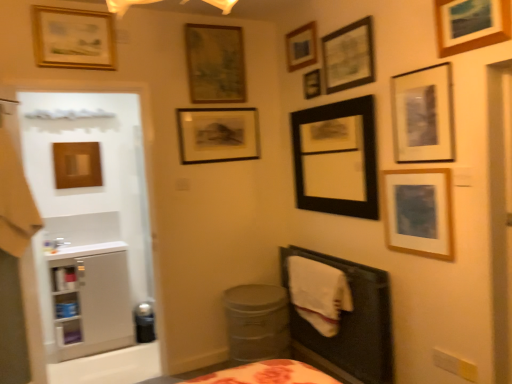
How much space does black matte picture frame at center, which appears as the fourth picture frame when viewed from the left, occupy horizontally?

black matte picture frame at center, which appears as the fourth picture frame when viewed from the left, is 1.61 inches in width.

What do you see at coordinates (144, 322) in the screenshot? I see `black plastic potty at lower left, the 2th potty when ordered from front to back` at bounding box center [144, 322].

Describe the element at coordinates (91, 232) in the screenshot. This screenshot has width=512, height=384. I see `white glossy cabinet at left` at that location.

What do you see at coordinates (91, 300) in the screenshot?
I see `white matte medicine cabinet at left` at bounding box center [91, 300].

Image resolution: width=512 pixels, height=384 pixels. In order to click on black matte picture frame at center, which ranks as the eighth picture frame in right-to-left order in this screenshot , I will do `click(217, 134)`.

Can you tell me how much gold-framed picture at upper left, which ranks as the tenth picture frame in right-to-left order, and white glossy cabinet at left differ in facing direction?

The angle between the facing direction of gold-framed picture at upper left, which ranks as the tenth picture frame in right-to-left order, and the facing direction of white glossy cabinet at left is 1.93 degrees.

Does gold-framed picture at upper left, the 2th picture frame from the left, have a greater width compared to white glossy cabinet at left?

No, gold-framed picture at upper left, the 2th picture frame from the left, is not wider than white glossy cabinet at left.

Between gold-framed picture at upper left, the 2th picture frame from the left, and white glossy cabinet at left, which one appears on the right side from the viewer's perspective?

white glossy cabinet at left.

Is white glossy cabinet at left surrounded by gold-framed picture at upper left, the 2th picture frame from the left?

No, white glossy cabinet at left is not surrounded by gold-framed picture at upper left, the 2th picture frame from the left.

Between gold-framed picture at upper left, which ranks as the tenth picture frame in right-to-left order, and wooden framed print at right, marked as the tenth picture frame in a left-to-right arrangement, which one has smaller size?

wooden framed print at right, marked as the tenth picture frame in a left-to-right arrangement.

Is point (38, 21) positioned behind point (414, 215)?

Yes, it is behind point (414, 215).

Is gold-framed picture at upper left, which ranks as the tenth picture frame in right-to-left order, positioned with its back to wooden framed print at right, marked as the tenth picture frame in a left-to-right arrangement?

That's not correct — gold-framed picture at upper left, which ranks as the tenth picture frame in right-to-left order, is not looking away from wooden framed print at right, marked as the tenth picture frame in a left-to-right arrangement.

Looking at this image, considering the sizes of objects wooden framed print at right, positioned as the second picture frame in right-to-left order, and metallic gray potty at lower center, the 1th potty when ordered from right to left, in the image provided, who is thinner, wooden framed print at right, positioned as the second picture frame in right-to-left order, or metallic gray potty at lower center, the 1th potty when ordered from right to left,?

wooden framed print at right, positioned as the second picture frame in right-to-left order, is thinner.

Is wooden framed print at right, marked as the tenth picture frame in a left-to-right arrangement, situated inside metallic gray potty at lower center, the 1th potty when ordered from right to left, or outside?

wooden framed print at right, marked as the tenth picture frame in a left-to-right arrangement, is not inside metallic gray potty at lower center, the 1th potty when ordered from right to left, it's outside.

Is point (389, 213) farther from camera compared to point (239, 348)?

No, it is in front of (239, 348).

Locate an element on the screen. The image size is (512, 384). the 1st potty below the wooden framed print at right, positioned as the second picture frame in right-to-left order (from the image's perspective) is located at coordinates (257, 322).

Is metallic gray potty at lower center, the 2th potty when ordered from left to right, inside or outside of white matte medicine cabinet at left?

metallic gray potty at lower center, the 2th potty when ordered from left to right, is outside white matte medicine cabinet at left.

From the image's perspective, relative to white matte medicine cabinet at left, is metallic gray potty at lower center, placed as the 2th potty when sorted from back to front, above or below?

Clearly, from the image's perspective, metallic gray potty at lower center, placed as the 2th potty when sorted from back to front, is below white matte medicine cabinet at left.

What's the angular difference between metallic gray potty at lower center, the 2th potty when ordered from left to right, and white matte medicine cabinet at left's facing directions?

0.145 degrees.

Is metallic gray potty at lower center, the 1th potty when ordered from right to left, closer to camera compared to white matte medicine cabinet at left?

Yes, the depth of metallic gray potty at lower center, the 1th potty when ordered from right to left, is less than that of white matte medicine cabinet at left.

Considering the relative positions of black plastic potty at lower left, acting as the first potty starting from the left, and wooden textured picture frame at upper center, the 3th picture frame viewed from the left, in the image provided, is black plastic potty at lower left, acting as the first potty starting from the left, to the left of wooden textured picture frame at upper center, the 3th picture frame viewed from the left, from the viewer's perspective?

Yes, black plastic potty at lower left, acting as the first potty starting from the left, is to the left of wooden textured picture frame at upper center, the 3th picture frame viewed from the left.

In the image, is black plastic potty at lower left, the 2th potty when ordered from front to back, positioned in front of or behind wooden textured picture frame at upper center, the 3th picture frame viewed from the left?

black plastic potty at lower left, the 2th potty when ordered from front to back, is positioned farther from the viewer than wooden textured picture frame at upper center, the 3th picture frame viewed from the left.

From a real-world perspective, is black plastic potty at lower left, the first potty positioned from the back, under wooden textured picture frame at upper center, which appears as the 9th picture frame when viewed from the right?

Yes, from a real-world perspective, black plastic potty at lower left, the first potty positioned from the back, is under wooden textured picture frame at upper center, which appears as the 9th picture frame when viewed from the right.

The image size is (512, 384). I want to click on the 4th picture frame in front of the brown matte picture frame at upper left, which ranks as the 1th picture frame in left-to-right order, so click(x=301, y=47).

Could you tell me if brown matte picture frame at upper left, which ranks as the 1th picture frame in left-to-right order, is turned towards wooden picture frame at upper center, marked as the seventh picture frame in a right-to-left arrangement?

No, brown matte picture frame at upper left, which ranks as the 1th picture frame in left-to-right order, is not turned towards wooden picture frame at upper center, marked as the seventh picture frame in a right-to-left arrangement.

Which is behind, point (87, 146) or point (287, 49)?

The point (87, 146) is farther from the camera.

Can you confirm if brown matte picture frame at upper left, which is the eleventh picture frame in right-to-left order, is wider than wooden picture frame at upper center, marked as the seventh picture frame in a right-to-left arrangement?

Incorrect, the width of brown matte picture frame at upper left, which is the eleventh picture frame in right-to-left order, does not surpass that of wooden picture frame at upper center, marked as the seventh picture frame in a right-to-left arrangement.

What's the angular difference between metallic gray potty at lower center, the 1th potty from the front, and black matte picture frame at upper center, which is the 5th picture frame from right to left,'s facing directions?

89.8 degrees separate the facing orientations of metallic gray potty at lower center, the 1th potty from the front, and black matte picture frame at upper center, which is the 5th picture frame from right to left.

From a real-world perspective, is metallic gray potty at lower center, the 1th potty from the front, positioned above or below black matte picture frame at upper center, which is the 7th picture frame from left to right?

Clearly, from a real-world perspective, metallic gray potty at lower center, the 1th potty from the front, is below black matte picture frame at upper center, which is the 7th picture frame from left to right.

Is metallic gray potty at lower center, the 1th potty when ordered from right to left, located outside black matte picture frame at upper center, which is the 7th picture frame from left to right?

That's correct, metallic gray potty at lower center, the 1th potty when ordered from right to left, is outside of black matte picture frame at upper center, which is the 7th picture frame from left to right.

From the image's perspective, is metallic gray potty at lower center, the 1th potty when ordered from right to left, above black matte picture frame at upper center, which is the 5th picture frame from right to left?

No, from the image's perspective, metallic gray potty at lower center, the 1th potty when ordered from right to left, is not on top of black matte picture frame at upper center, which is the 5th picture frame from right to left.

Identify the location of screen door that is on the right side of gold-framed picture at upper left, the 2th picture frame from the left. This screenshot has width=512, height=384. (91, 232).

Locate an element on the screen. the 8th picture frame to the left of the wooden framed print at right, marked as the tenth picture frame in a left-to-right arrangement, starting your count from the anchor is located at coordinates (73, 38).

Considering their positions, is wooden textured picture frame at upper center, the 3th picture frame viewed from the left, positioned further to white matte medicine cabinet at left than black plastic potty at lower left, the first potty positioned from the back?

wooden textured picture frame at upper center, the 3th picture frame viewed from the left.

Looking at the image, which one is located closer to matte black picture frame at upper center, which ranks as the eighth picture frame in left-to-right order, brown matte picture frame at upper left, which is the eleventh picture frame in right-to-left order, or metallic gray potty at lower center, the 2th potty when ordered from left to right?

metallic gray potty at lower center, the 2th potty when ordered from left to right, lies closer to matte black picture frame at upper center, which ranks as the eighth picture frame in left-to-right order, than the other object.

Which object lies nearer to the anchor point metallic gray potty at lower center, the 1th potty from the front, wooden picture frame at upper right, which ranks as the 11th picture frame in left-to-right order, or wooden picture frame at upper center, which is the 6th picture frame in left-to-right order?

Based on the image, wooden picture frame at upper center, which is the 6th picture frame in left-to-right order, appears to be nearer to metallic gray potty at lower center, the 1th potty from the front.

Based on their spatial positions, is gold-framed picture at upper left, the 2th picture frame from the left, or wooden picture frame at upper center, which is the 6th picture frame in left-to-right order, further from white matte medicine cabinet at left?

wooden picture frame at upper center, which is the 6th picture frame in left-to-right order.

In the scene shown: Based on their spatial positions, is wooden textured picture frame at upper center, which appears as the 9th picture frame when viewed from the right, or wooden picture frame at upper center, which appears as the fifth picture frame when viewed from the left, closer to black matte picture frame at center, which ranks as the eighth picture frame in right-to-left order?

wooden textured picture frame at upper center, which appears as the 9th picture frame when viewed from the right.

Estimate the real-world distances between objects in this image. Which object is closer to metallic gray potty at lower center, the 2th potty when ordered from left to right, black matte picture frame at center, which appears as the fourth picture frame when viewed from the left, or brown matte picture frame at upper left, which is the eleventh picture frame in right-to-left order?

black matte picture frame at center, which appears as the fourth picture frame when viewed from the left.

Consider the image. When comparing their distances from wooden textured picture frame at upper center, the 3th picture frame viewed from the left, does wooden framed print at right, marked as the tenth picture frame in a left-to-right arrangement, or gold-framed picture at upper left, the 2th picture frame from the left, seem further?

Based on the image, wooden framed print at right, marked as the tenth picture frame in a left-to-right arrangement, appears to be further to wooden textured picture frame at upper center, the 3th picture frame viewed from the left.

Estimate the real-world distances between objects in this image. Which object is further from black matte picture frame at center, which ranks as the eighth picture frame in right-to-left order, black plastic potty at lower left, the 2th potty when ordered from front to back, or wooden framed print at right, positioned as the second picture frame in right-to-left order?

Based on the image, black plastic potty at lower left, the 2th potty when ordered from front to back, appears to be further to black matte picture frame at center, which ranks as the eighth picture frame in right-to-left order.

Locate an element on the screen. screen door between wooden picture frame at upper center, which appears as the fifth picture frame when viewed from the left, and black plastic potty at lower left, placed as the second potty when sorted from right to left, vertically is located at coordinates (91, 232).

Locate an element on the screen. This screenshot has height=384, width=512. medicine cabinet between brown matte picture frame at upper left, which ranks as the 1th picture frame in left-to-right order, and black plastic potty at lower left, the 2th potty when ordered from front to back, vertically is located at coordinates (91, 300).

The width and height of the screenshot is (512, 384). I want to click on medicine cabinet between matte black picture frame at upper center, positioned as the fourth picture frame in right-to-left order, and metallic gray potty at lower center, the 2th potty when ordered from left to right, from top to bottom, so click(91, 300).

Locate an element on the screen. The height and width of the screenshot is (384, 512). screen door situated between brown matte picture frame at upper left, which is the eleventh picture frame in right-to-left order, and matte black picture frame at upper center, which ranks as the eighth picture frame in left-to-right order, from left to right is located at coordinates (91, 232).